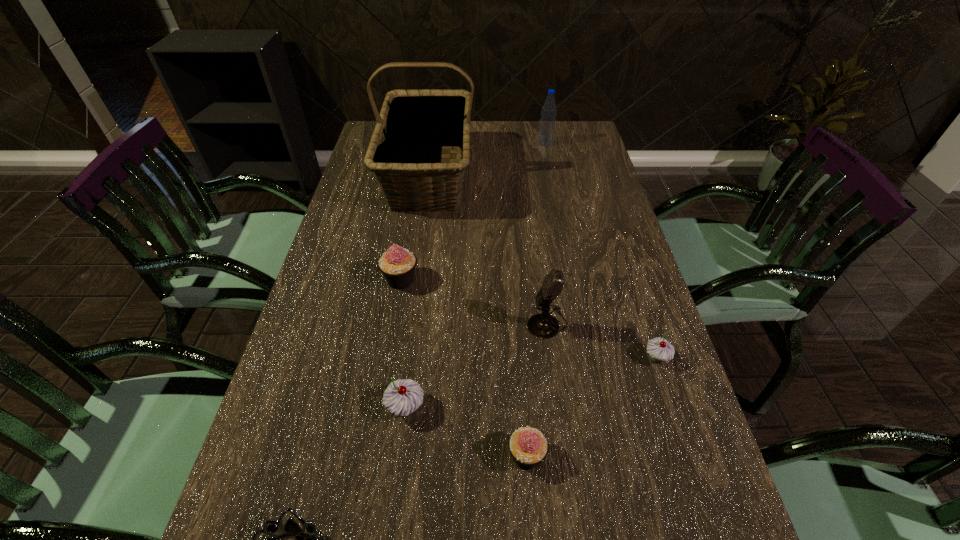
Where is `vacant space at the right edge of the desktop`? vacant space at the right edge of the desktop is located at coordinates (595, 232).

You are a GUI agent. You are given a task and a screenshot of the screen. Output one action in this format:
    pyautogui.click(x=<x>, y=<y>)
    Task: Click on the free space between the microphone and the second farthest cupcake
    The height and width of the screenshot is (540, 960).
    Given the screenshot: What is the action you would take?
    pyautogui.click(x=602, y=340)

This screenshot has height=540, width=960. Find the location of `blank region between the water bottle and the second nearest cupcake`. blank region between the water bottle and the second nearest cupcake is located at coordinates (475, 275).

Image resolution: width=960 pixels, height=540 pixels. Identify the location of free space that is in between the tallest object and the farther gray cupcake. (542, 267).

What are the coordinates of `vacant space that is in between the water bottle and the basket` in the screenshot? It's located at (488, 159).

At what (x,y) coordinates should I click in order to perform the action: click on vacant area between the farthest cupcake and the fifth nearest object. Please return your answer as a coordinate pair (x, y). Looking at the image, I should click on (474, 301).

Locate an element on the screen. vacant space that is in between the fourth nearest object and the seventh object from left to right is located at coordinates (601, 250).

The height and width of the screenshot is (540, 960). Identify the location of vacant region between the second object from right to left and the fourth farthest object. (546, 233).

I want to click on free space between the microphone and the third nearest cupcake, so click(602, 340).

Find the location of `free space between the rightmost cupcake and the blue water bottle`. free space between the rightmost cupcake and the blue water bottle is located at coordinates (601, 250).